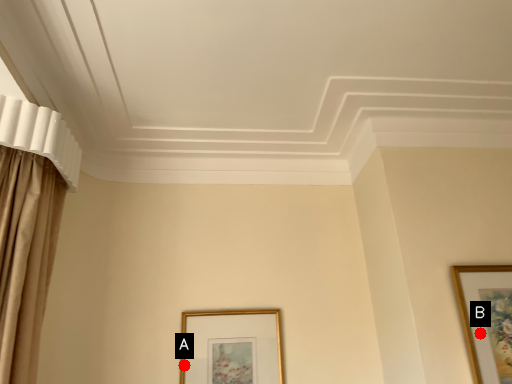
Question: Two points are circled on the image, labeled by A and B beside each circle. Which point appears farthest from the camera in this image?

Choices:
 (A) A is further
 (B) B is further

Answer: (A)